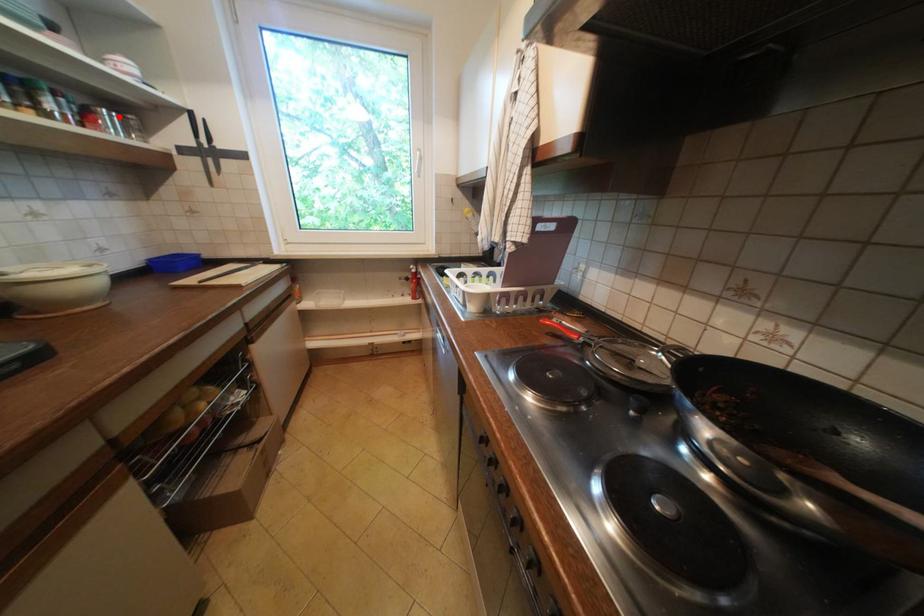
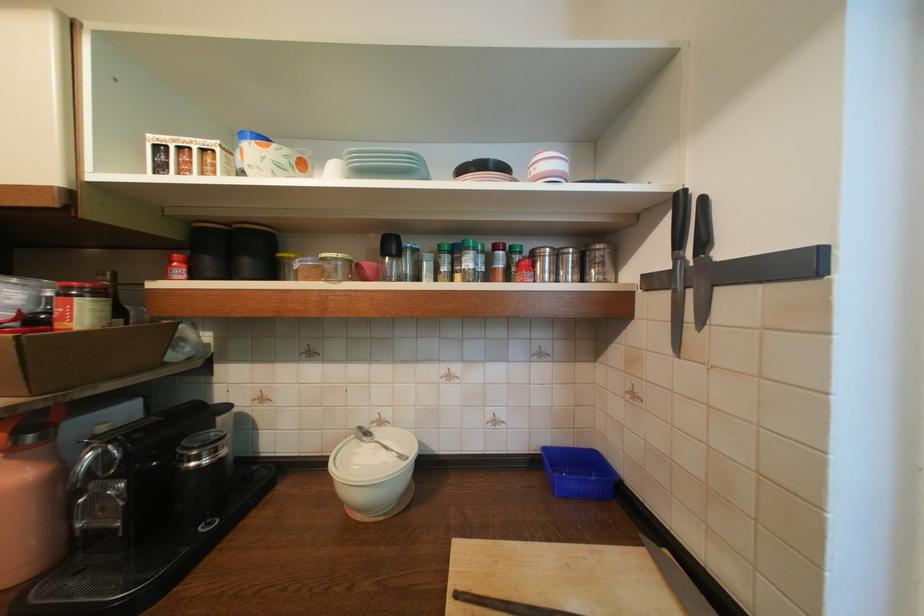
In the second image, find the point that corresponds to the highlighted location in the first image.

(565, 256)